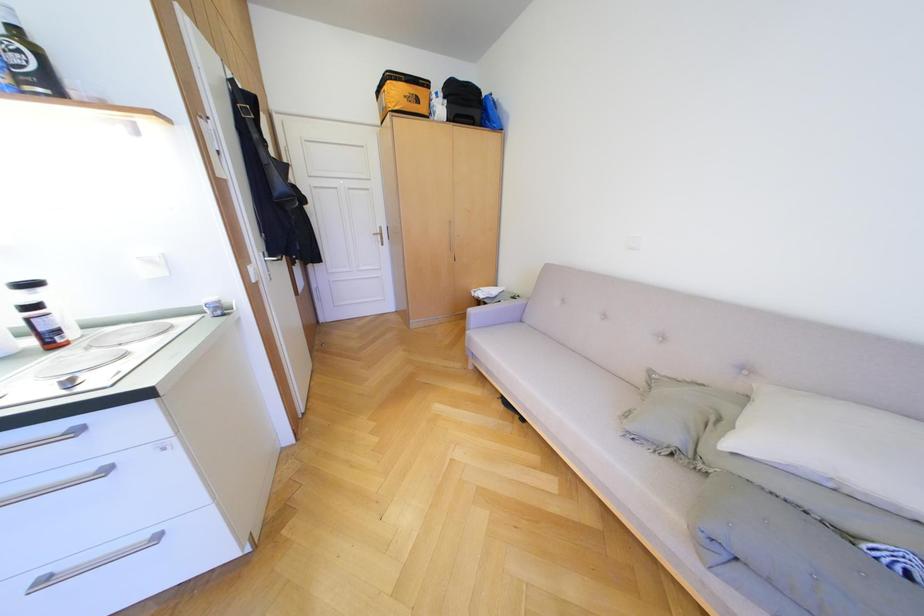
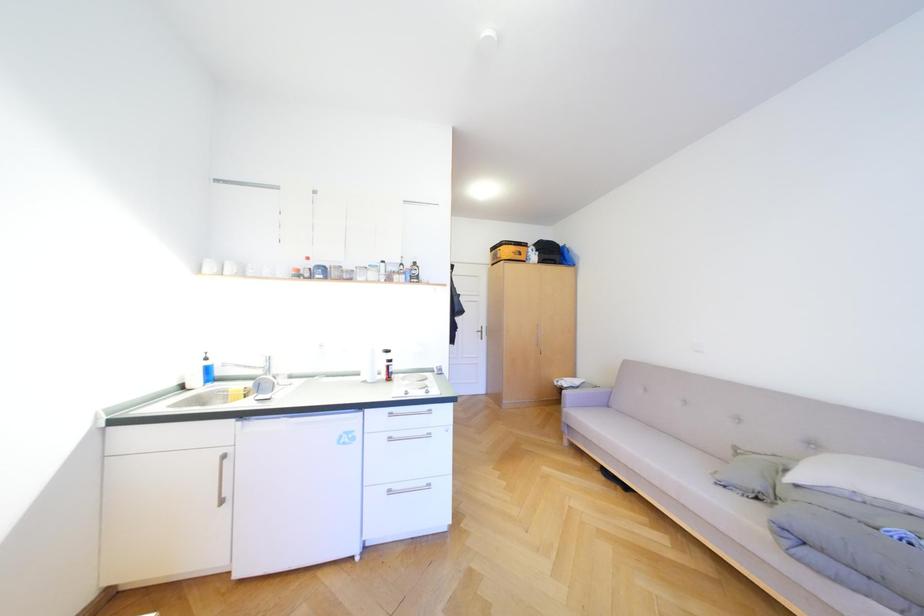
The images are taken continuously from a first-person perspective. In which direction are you moving?

The cameraman moved toward left, backward.